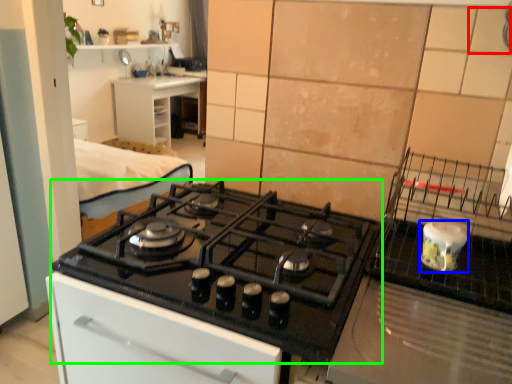
Question: Which is nearer to the tile (highlighted by a red box)? kitchen appliance (highlighted by a blue box) or gas stove (highlighted by a green box).

Choices:
 (A) kitchen appliance
 (B) gas stove

Answer: (A)